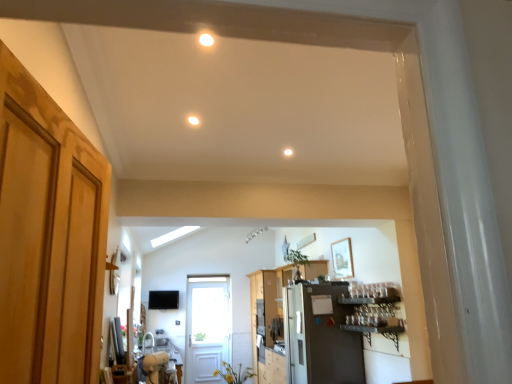
Where is `vacant area that is situated to the right of white matte light fixture at center, the third lighting viewed from the left`? vacant area that is situated to the right of white matte light fixture at center, the third lighting viewed from the left is located at coordinates (308, 152).